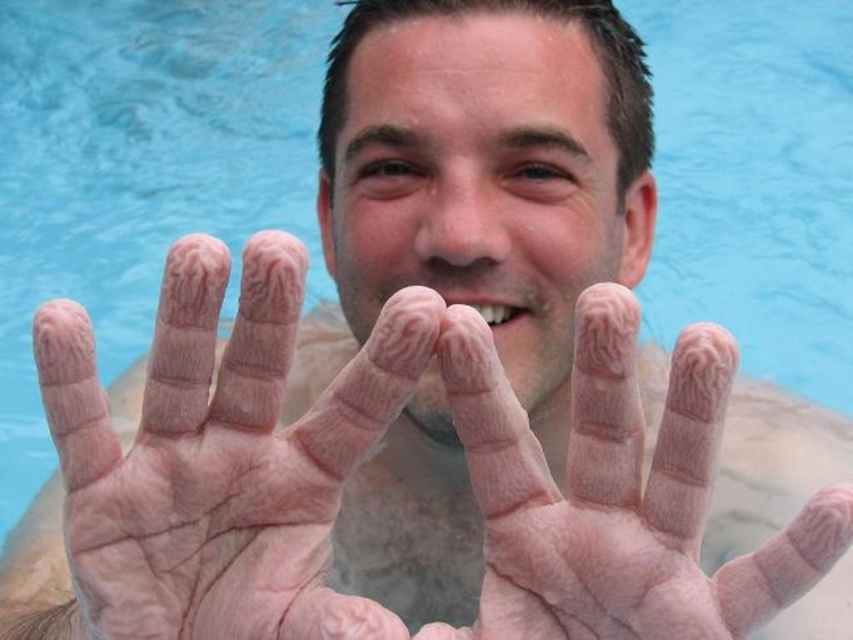
Question: Can you confirm if pale skin palm at center is thinner than pink flesh at center?

Choices:
 (A) yes
 (B) no

Answer: (A)

Question: Can you confirm if pale skin palm at center is positioned to the left of pink flesh at center?

Choices:
 (A) yes
 (B) no

Answer: (A)

Question: Which object is farther from the camera taking this photo?

Choices:
 (A) pink flesh at center
 (B) pale skin palm at center

Answer: (B)

Question: Which of the following is the closest to the observer?

Choices:
 (A) (697, 534)
 (B) (119, 616)

Answer: (A)

Question: Is pale skin palm at center thinner than pink flesh at center?

Choices:
 (A) no
 (B) yes

Answer: (B)